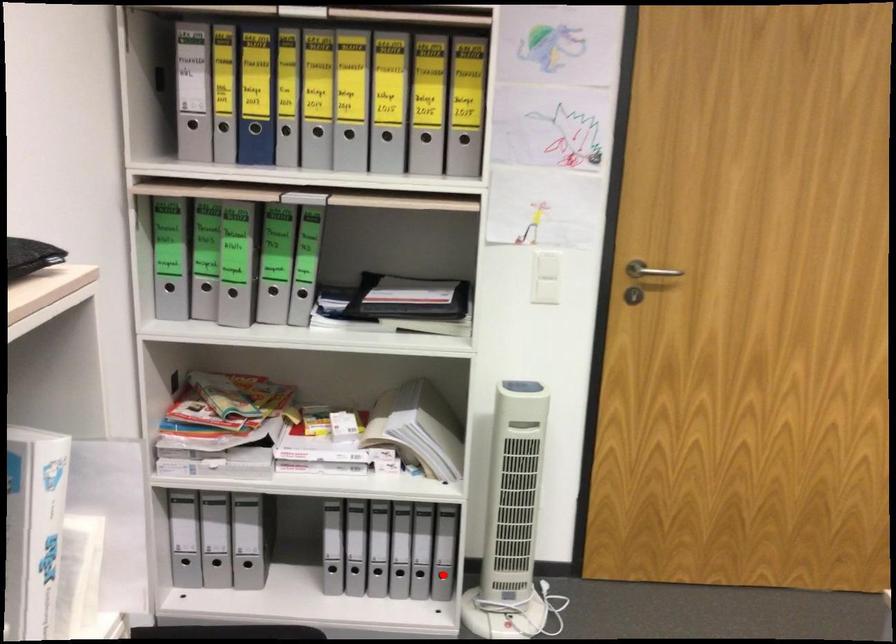
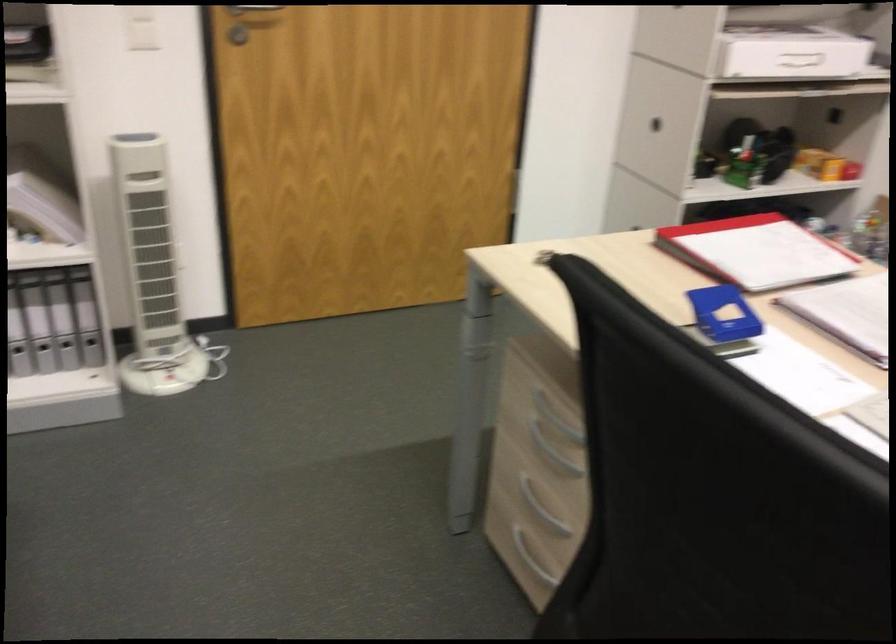
Where in the second image is the point corresponding to the highlighted location from the first image?

(91, 339)